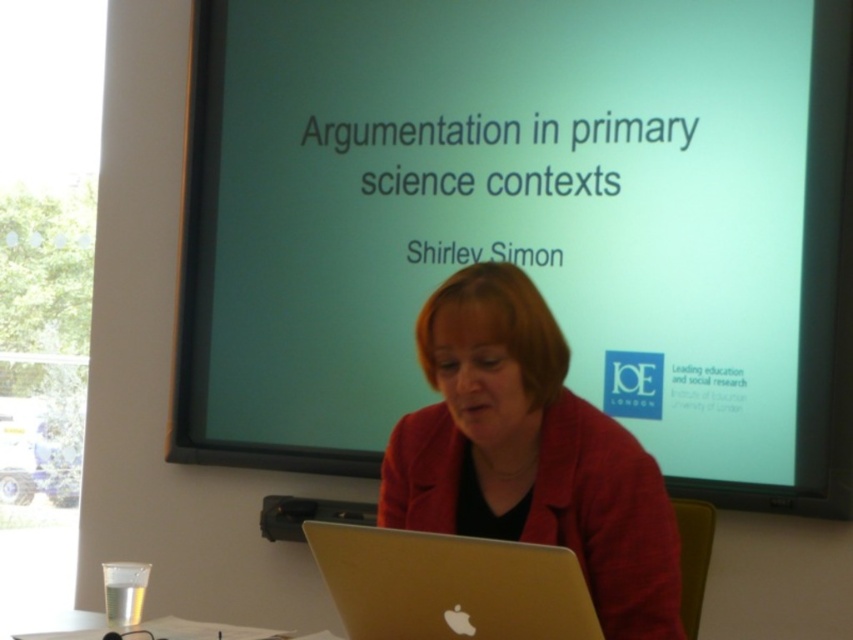
From the picture: You are a student in the classroom. You need to look at the slide on the green matte projection screen at upper center while taking notes on your silver metallic laptop at center. Which object is positioned to the right of the other?

The green matte projection screen at upper center is positioned to the right of the silver metallic laptop at center.

You are a student trying to decide which laptop to use for a presentation. The matte gold laptop at center and the silver metallic laptop at center are both available. Which one is taller?

The matte gold laptop at center is taller than the silver metallic laptop at center.

You are a student trying to decide which laptop to use for your presentation. You see a matte gold laptop at center and a silver metallic laptop at center. Which one is on the right side?

The matte gold laptop at center is positioned on the right side of the silver metallic laptop at center, so the matte gold laptop at center is on the right.